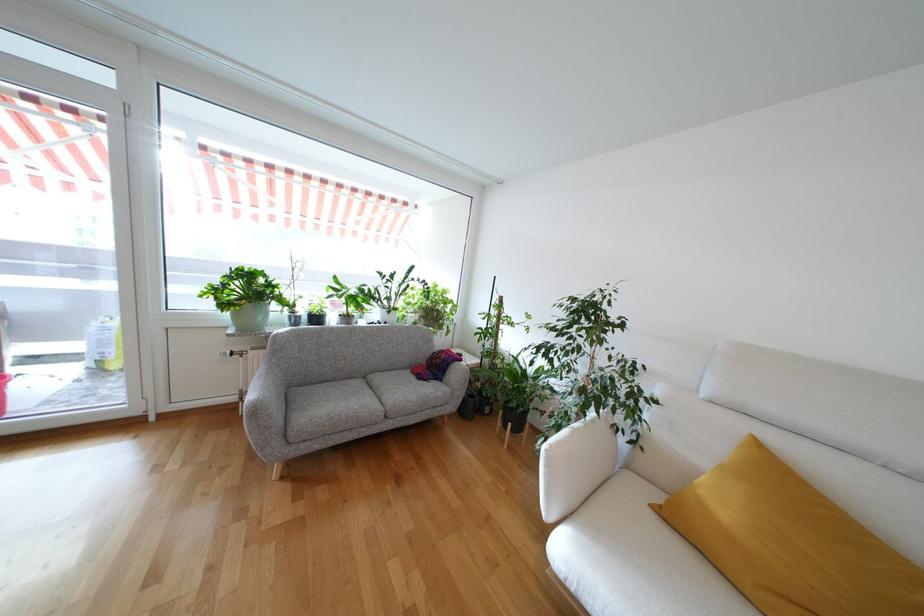
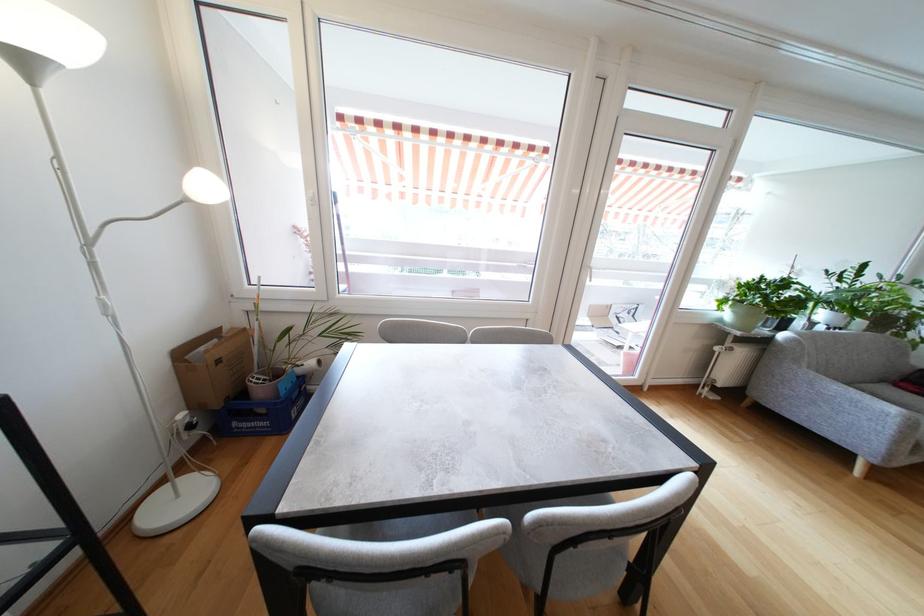
Which direction would the cameraman need to move to produce the second image?

The cameraman walked toward left, backward.